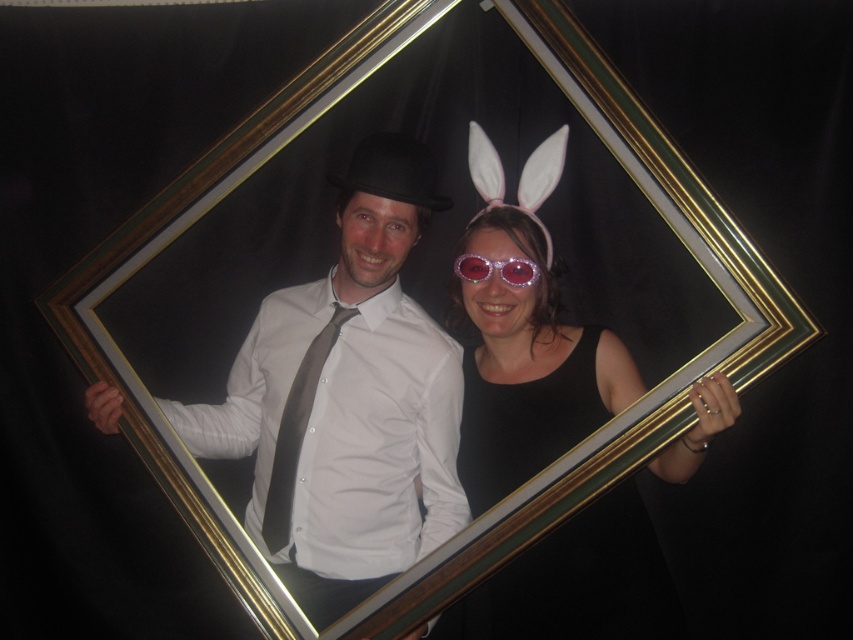
Question: Estimate the real-world distances between objects in this image. Which object is farther from the sparkly pink sunglasses at center?

Choices:
 (A) sparkly pink goggles at center
 (B) matte black bowler hat at center
 (C) gray satin tie at center
 (D) black matte dress at lower right

Answer: (C)

Question: Which point is closer to the camera taking this photo?

Choices:
 (A) (283, 456)
 (B) (459, 268)
 (C) (459, 460)
 (D) (531, 634)

Answer: (A)

Question: Which point is farther to the camera?

Choices:
 (A) sparkly pink goggles at center
 (B) gray satin tie at center
 (C) black matte dress at lower right
 (D) matte black bowler hat at center

Answer: (B)

Question: Does gray satin tie at center appear on the right side of sparkly pink goggles at center?

Choices:
 (A) no
 (B) yes

Answer: (A)

Question: Can you confirm if matte black bowler hat at center is smaller than sparkly pink sunglasses at center?

Choices:
 (A) yes
 (B) no

Answer: (A)

Question: Is matte black bowler hat at center further to the viewer compared to sparkly pink goggles at center?

Choices:
 (A) no
 (B) yes

Answer: (A)